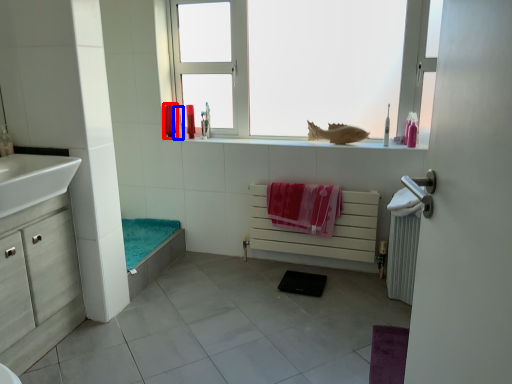
Question: Which object appears farthest to the camera in this image, toiletry (highlighted by a red box) or toiletry (highlighted by a blue box)?

Choices:
 (A) toiletry
 (B) toiletry

Answer: (A)